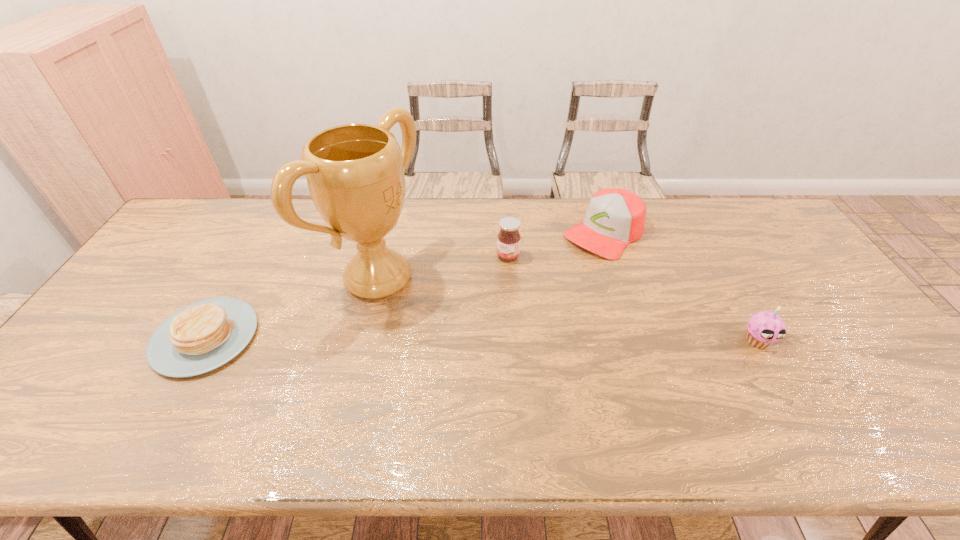
You are a GUI agent. You are given a task and a screenshot of the screen. Output one action in this format:
    pyautogui.click(x=<x>, y=<y>)
    Task: Click on the free space located 0.100m on the front-facing side of the baseball cap
    This screenshot has height=540, width=960.
    Given the screenshot: What is the action you would take?
    pyautogui.click(x=564, y=269)

The image size is (960, 540). What are the coordinates of `free space located on the front-facing side of the baseball cap` in the screenshot? It's located at (506, 322).

Identify the location of free space located on the front of the tallest object with the decoration. The width and height of the screenshot is (960, 540). pyautogui.click(x=523, y=362).

Where is `vacant space located on the front of the tallest object with the decoration`? This screenshot has width=960, height=540. vacant space located on the front of the tallest object with the decoration is located at coordinates (445, 322).

Where is `vacant space located on the front of the tallest object with the decoration`? Image resolution: width=960 pixels, height=540 pixels. vacant space located on the front of the tallest object with the decoration is located at coordinates (496, 348).

I want to click on vacant space situated on the label side of the third object from right to left, so click(426, 346).

The image size is (960, 540). I want to click on vacant space located 0.380m on the label side of the third object from right to left, so click(x=426, y=346).

I want to click on vacant space situated on the label side of the third object from right to left, so click(x=426, y=346).

The width and height of the screenshot is (960, 540). I want to click on baseball cap situated at the far edge, so click(x=615, y=217).

The height and width of the screenshot is (540, 960). I want to click on award situated at the far edge, so click(355, 172).